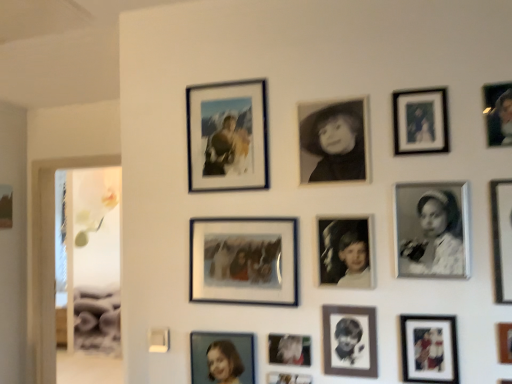
Question: From a real-world perspective, is black matte photo at center, which is the 8th picture frame from back to front, located higher than black paper portrait at center, which is counted as the sixth picture frame, starting from the front?

Choices:
 (A) yes
 (B) no

Answer: (A)

Question: Is black matte photo at center, the 7th picture frame viewed from the front, positioned far away from black paper portrait at center, which is the 9th picture frame from back to front?

Choices:
 (A) yes
 (B) no

Answer: (B)

Question: Is black matte photo at center, the 7th picture frame viewed from the front, not inside black paper portrait at center, which is counted as the sixth picture frame, starting from the front?

Choices:
 (A) no
 (B) yes

Answer: (B)

Question: Is black matte photo at center, the 7th picture frame from the right, taller than black paper portrait at center, which is counted as the 9th picture frame, starting from the left?

Choices:
 (A) yes
 (B) no

Answer: (A)

Question: From the image's perspective, would you say black matte photo at center, which is the 8th picture frame from back to front, is shown under black paper portrait at center, which is counted as the 9th picture frame, starting from the left?

Choices:
 (A) no
 (B) yes

Answer: (A)

Question: Is matte black photo frame at lower right, marked as the fourth picture frame in a right-to-left arrangement, wider or thinner than black matte portrait at center, the eighth picture frame positioned from the front?

Choices:
 (A) wide
 (B) thin

Answer: (A)

Question: From the image's perspective, is matte black photo frame at lower right, placed as the 3th picture frame when sorted from front to back, above or below black matte portrait at center, the 7th picture frame viewed from the back?

Choices:
 (A) below
 (B) above

Answer: (A)

Question: Does point (422, 372) appear closer or farther from the camera than point (362, 142)?

Choices:
 (A) farther
 (B) closer

Answer: (B)

Question: Based on their sizes in the image, would you say matte black photo frame at lower right, the 11th picture frame positioned from the left, is bigger or smaller than black matte portrait at center, which appears as the 8th picture frame when viewed from the right?

Choices:
 (A) small
 (B) big

Answer: (A)

Question: Is point (510, 183) closer or farther from the camera than point (284, 291)?

Choices:
 (A) farther
 (B) closer

Answer: (B)

Question: From a real-world perspective, is metallic silver picture frame at right, which is the fourteenth picture frame from left to right, above or below matte glass photo frame at center, the eleventh picture frame in the front-to-back sequence?

Choices:
 (A) below
 (B) above

Answer: (B)

Question: Would you say metallic silver picture frame at right, which is the fourteenth picture frame from left to right, is inside or outside matte glass photo frame at center, which is the fourth picture frame from back to front?

Choices:
 (A) inside
 (B) outside

Answer: (B)

Question: In terms of size, does metallic silver picture frame at right, which is the first picture frame in right-to-left order, appear bigger or smaller than matte glass photo frame at center, which is the fourth picture frame from back to front?

Choices:
 (A) small
 (B) big

Answer: (B)

Question: From the image's perspective, relative to matte glass photo frame at upper center, which is counted as the 2th picture frame, starting from the back, is matte blue photo frame at lower center, the second picture frame viewed from the left, above or below?

Choices:
 (A) above
 (B) below

Answer: (B)

Question: Is matte blue photo frame at lower center, acting as the thirteenth picture frame starting from the right, in front of or behind matte glass photo frame at upper center, which is counted as the 2th picture frame, starting from the back, in the image?

Choices:
 (A) front
 (B) behind

Answer: (A)